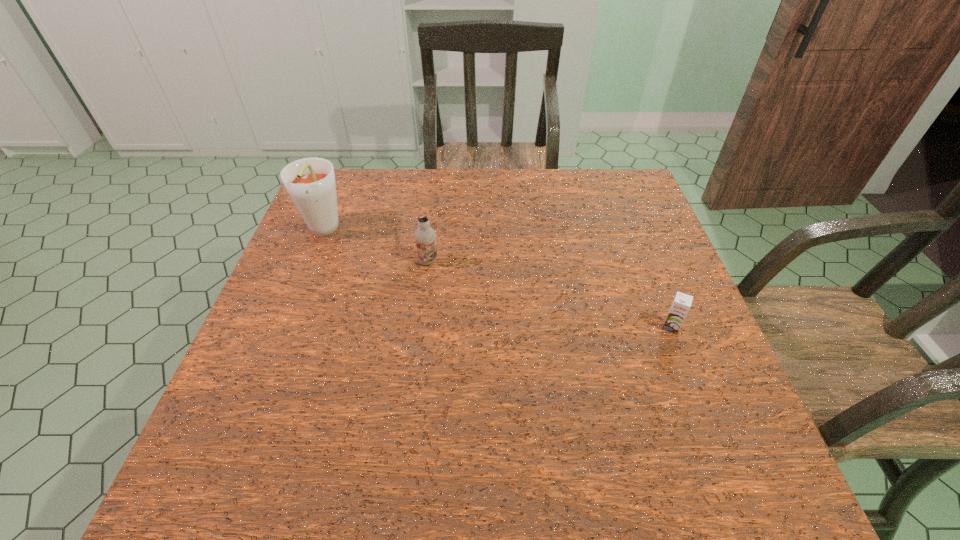
Find the location of a particular element. This screenshot has width=960, height=540. vacant position in the image that satisfies the following two spatial constraints: 1. on the drink side of the second farthest object; 2. on the left side of the root beer is located at coordinates (311, 261).

You are a GUI agent. You are given a task and a screenshot of the screen. Output one action in this format:
    pyautogui.click(x=<x>, y=<y>)
    Task: Click on the free space that satisfies the following two spatial constraints: 1. on the drink side of the right chocolate milk; 2. on the left side of the leftmost object
    This screenshot has height=540, width=960.
    Given the screenshot: What is the action you would take?
    pyautogui.click(x=285, y=327)

Locate an element on the screen. vacant region that satisfies the following two spatial constraints: 1. on the drink side of the shortest object; 2. on the right side of the root beer is located at coordinates (285, 327).

Locate an element on the screen. Image resolution: width=960 pixels, height=540 pixels. vacant region that satisfies the following two spatial constraints: 1. on the drink side of the nearest object; 2. on the left side of the root beer is located at coordinates (285, 327).